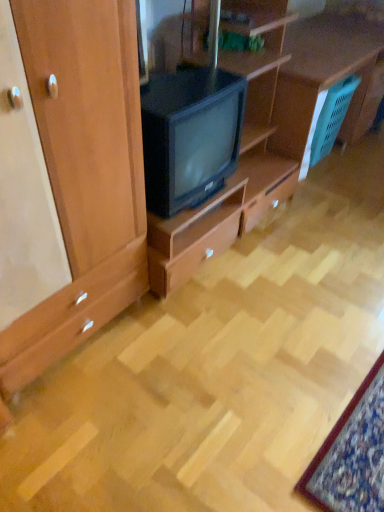
Where is `teal plastic picnic basket at right`? teal plastic picnic basket at right is located at coordinates (332, 118).

This screenshot has height=512, width=384. Describe the element at coordinates (332, 118) in the screenshot. I see `teal plastic picnic basket at right` at that location.

Identify the location of teal plastic picnic basket at right. The height and width of the screenshot is (512, 384). tap(332, 118).